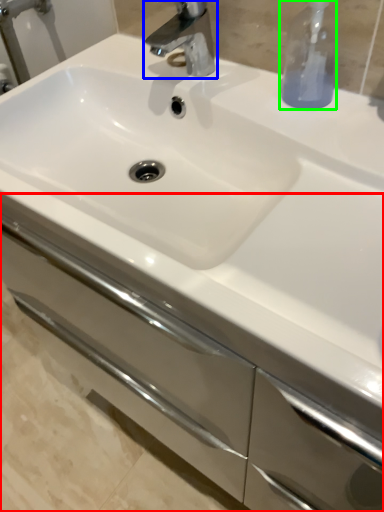
Question: Based on their relative distances, which object is nearer to bathroom cabinet (highlighted by a red box)? Choose from tap (highlighted by a blue box) and soap dispenser (highlighted by a green box).

Choices:
 (A) tap
 (B) soap dispenser

Answer: (B)